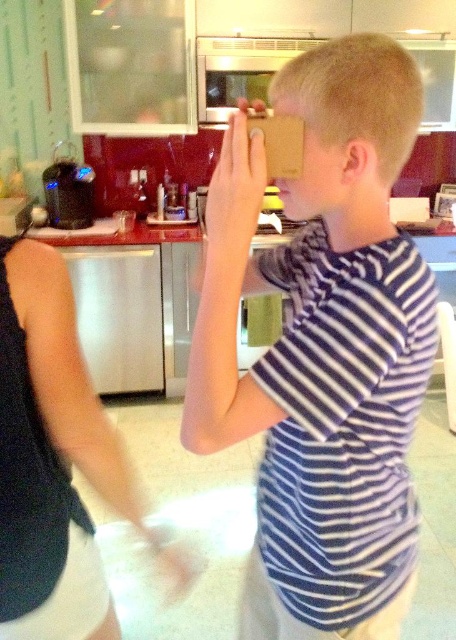
The height and width of the screenshot is (640, 456). Describe the element at coordinates (322, 348) in the screenshot. I see `white striped shirt at center` at that location.

Does white striped shirt at center appear on the left side of white fabric shirt at left?

Incorrect, white striped shirt at center is not on the left side of white fabric shirt at left.

This screenshot has width=456, height=640. Find the location of `white striped shirt at center`. white striped shirt at center is located at coordinates (322, 348).